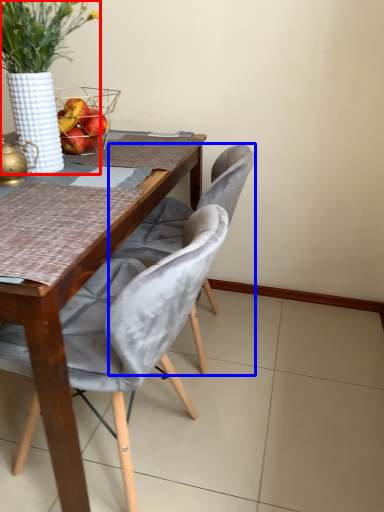
Question: Which of the following is the farthest to the observer, houseplant (highlighted by a red box) or chair (highlighted by a blue box)?

Choices:
 (A) houseplant
 (B) chair

Answer: (B)